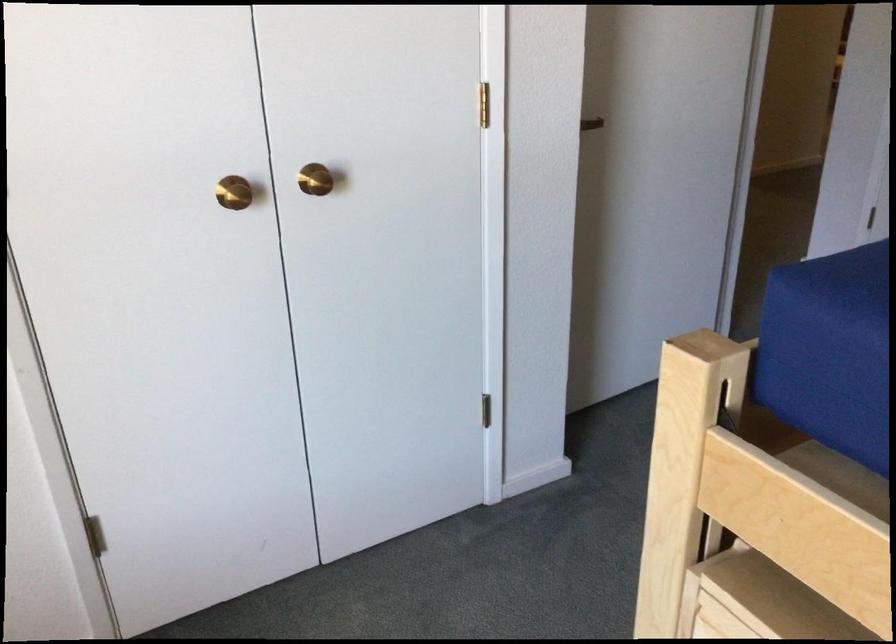
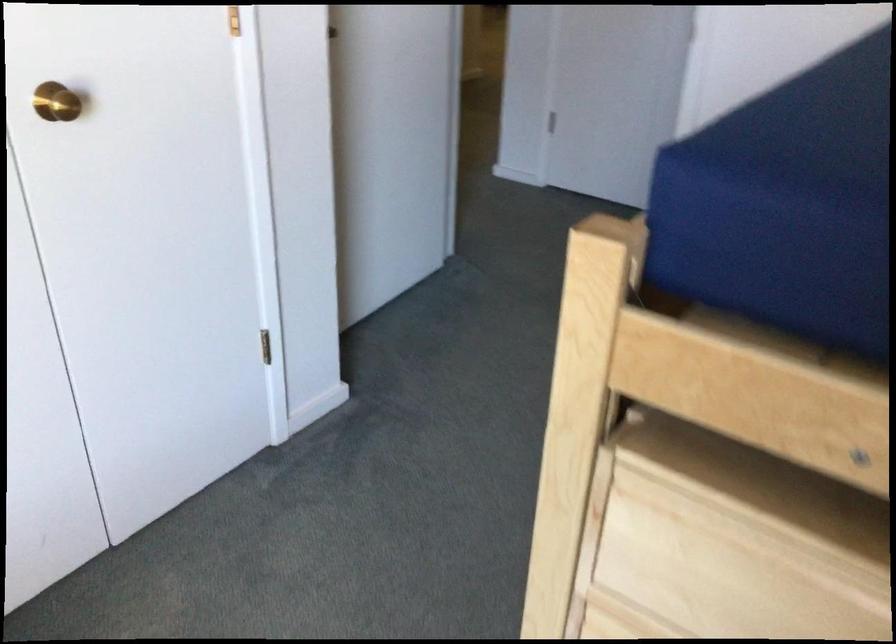
In the second image, find the point that corresponds to point (314, 180) in the first image.

(56, 102)